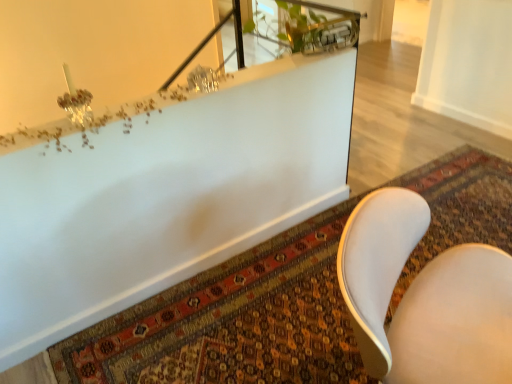
Question: Would you say carpeted mat at lower center is outside white leather chair at lower right?

Choices:
 (A) yes
 (B) no

Answer: (A)

Question: Is carpeted mat at lower center facing towards white leather chair at lower right?

Choices:
 (A) yes
 (B) no

Answer: (B)

Question: From a real-world perspective, is carpeted mat at lower center positioned over white leather chair at lower right based on gravity?

Choices:
 (A) no
 (B) yes

Answer: (A)

Question: Is carpeted mat at lower center in front of white leather chair at lower right?

Choices:
 (A) no
 (B) yes

Answer: (A)

Question: Is carpeted mat at lower center wider than white leather chair at lower right?

Choices:
 (A) no
 (B) yes

Answer: (B)

Question: From the image's perspective, does carpeted mat at lower center appear lower than white leather chair at lower right?

Choices:
 (A) yes
 (B) no

Answer: (B)

Question: Is the position of white leather chair at lower right less distant than that of white glossy bathtub at upper center?

Choices:
 (A) yes
 (B) no

Answer: (A)

Question: Does white leather chair at lower right appear on the left side of white glossy bathtub at upper center?

Choices:
 (A) no
 (B) yes

Answer: (A)

Question: Is white leather chair at lower right facing towards white glossy bathtub at upper center?

Choices:
 (A) yes
 (B) no

Answer: (B)

Question: Can you confirm if white leather chair at lower right is smaller than white glossy bathtub at upper center?

Choices:
 (A) no
 (B) yes

Answer: (B)

Question: Considering the relative sizes of white leather chair at lower right and white glossy bathtub at upper center in the image provided, is white leather chair at lower right shorter than white glossy bathtub at upper center?

Choices:
 (A) no
 (B) yes

Answer: (A)

Question: From the image's perspective, does white leather chair at lower right appear lower than white glossy bathtub at upper center?

Choices:
 (A) yes
 (B) no

Answer: (A)

Question: Is carpeted mat at lower center at the back of white leather chair at lower right?

Choices:
 (A) yes
 (B) no

Answer: (B)